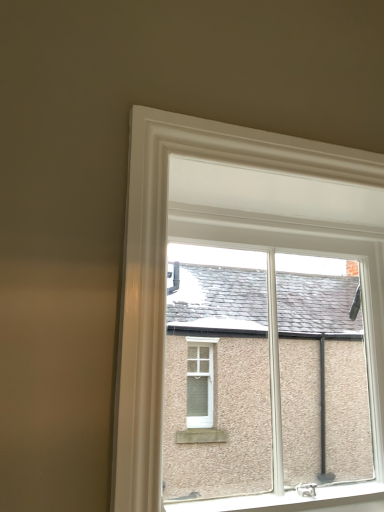
Describe the element at coordinates (165, 267) in the screenshot. The width and height of the screenshot is (384, 512). I see `clear glass window at upper center` at that location.

Where is `clear glass window at upper center`? Image resolution: width=384 pixels, height=512 pixels. clear glass window at upper center is located at coordinates (165, 267).

Identify the location of clear glass window at upper center. (165, 267).